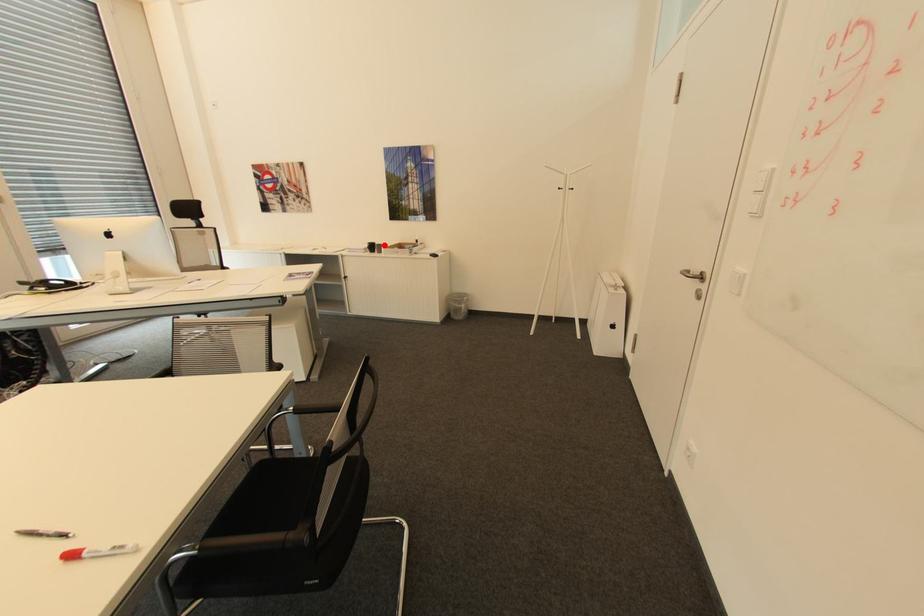
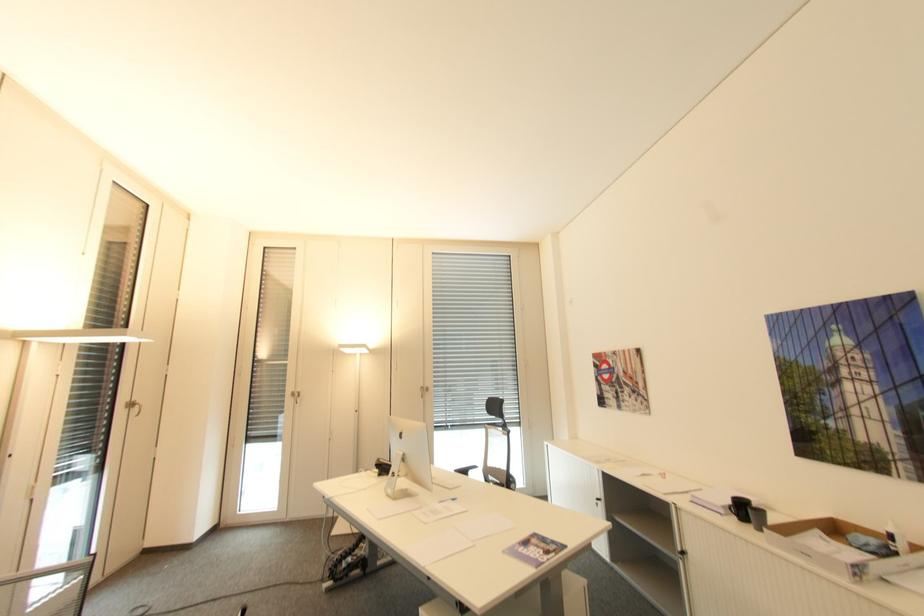
In the second image, find the point that corresponds to the highlighted location in the first image.

(766, 513)